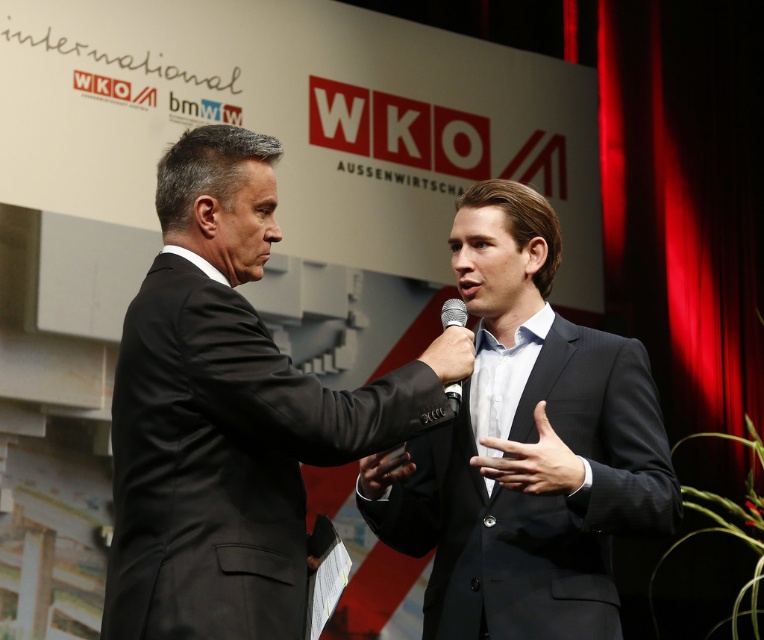
The width and height of the screenshot is (764, 640). What do you see at coordinates (450, 355) in the screenshot? I see `black matte microphone at center` at bounding box center [450, 355].

Who is positioned more to the left, black matte microphone at center or matte black hand at center?

matte black hand at center

Who is more forward, (455, 348) or (402, 470)?

Point (455, 348)

You are a GUI agent. You are given a task and a screenshot of the screen. Output one action in this format:
    pyautogui.click(x=<x>, y=<y>)
    Task: Click on the black matte microphone at center
    The height and width of the screenshot is (640, 764).
    Given the screenshot: What is the action you would take?
    pyautogui.click(x=450, y=355)

Who is positioned more to the right, dark gray suit at center or black smooth suit at center?

black smooth suit at center

Is dark gray suit at center taller than black smooth suit at center?

Yes.

Which is in front, point (649, 492) or point (549, 435)?

Point (549, 435) is more forward.

Where is `dark gray suit at center`? Image resolution: width=764 pixels, height=640 pixels. dark gray suit at center is located at coordinates (529, 449).

From the picture: Does matte black hand at center have a greater width compared to silver metallic microphone at center?

Yes.

Does matte black hand at center come in front of silver metallic microphone at center?

Yes.

Is point (364, 472) positioned before point (457, 388)?

No.

I want to click on matte black hand at center, so click(382, 472).